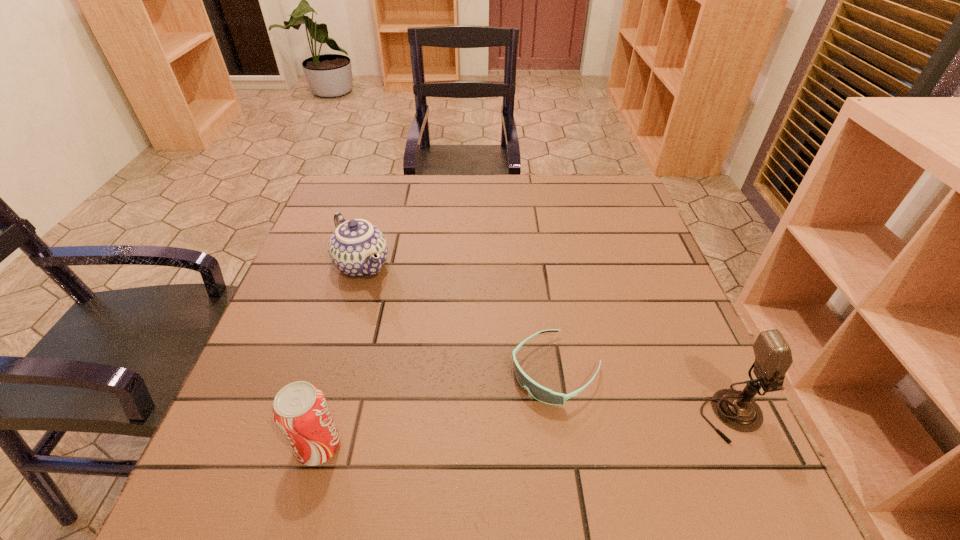
Find the location of a particular element. The width and height of the screenshot is (960, 540). soda can is located at coordinates (300, 411).

Identify the location of the rightmost object. (773, 357).

Where is `microphone`? The height and width of the screenshot is (540, 960). microphone is located at coordinates (773, 357).

Image resolution: width=960 pixels, height=540 pixels. Identify the location of chinaware. (357, 248).

The height and width of the screenshot is (540, 960). I want to click on the third object from left to right, so click(x=538, y=392).

You are a GUI agent. You are given a task and a screenshot of the screen. Output one action in this format:
    pyautogui.click(x=<x>, y=<y>)
    Task: Click on the goggles
    The height and width of the screenshot is (540, 960).
    Given the screenshot: What is the action you would take?
    pyautogui.click(x=538, y=392)

I want to click on vacant area located 0.080m on the logo side of the soda can, so click(x=389, y=446).

This screenshot has height=540, width=960. Identify the location of free space located from the spout of the chinaware. (409, 332).

Find the location of a particular element. This screenshot has height=540, width=960. vacant point located from the spout of the chinaware is located at coordinates click(387, 304).

Identify the location of vacant space situated from the spout of the chinaware. (471, 413).